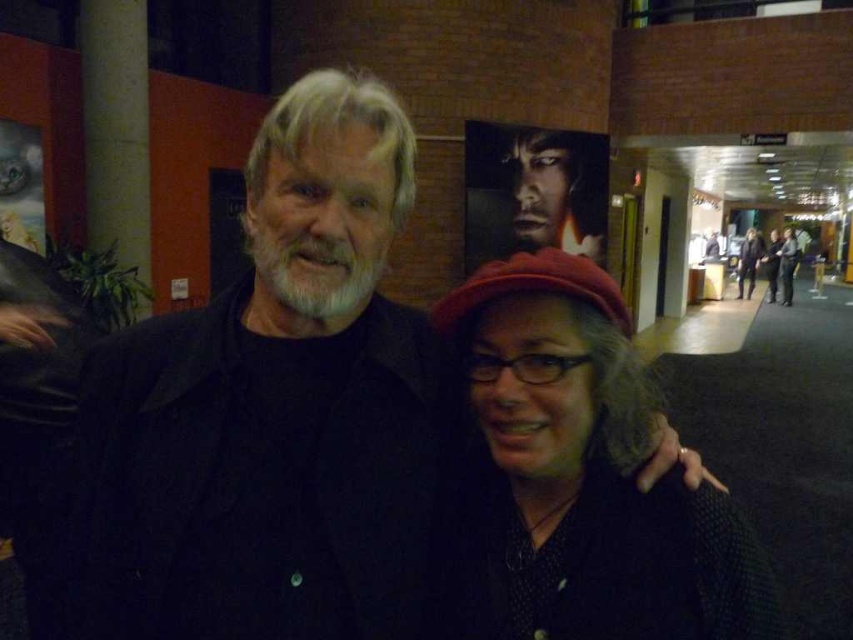
You are standing in the hallway and want to find the matte black sweater at center. According to the coordinates given, where should you look relative to the poster of a person?

The matte black sweater at center is located at coordinates point (x=579, y=476), which is to the right of the poster of a person since the x coordinate is greater than 0.5.

You are trying to determine which object is wider between the matte black sweater at center and the smooth black face at center. Based on the scene, which one is wider?

The smooth black face at center is wider than the matte black sweater at center.

You are a photographer trying to capture a photo of the dark gray sweater at center and the smooth black face at center. Which object is positioned to the left side in the image?

The smooth black face at center is to the left of the dark gray sweater at center.